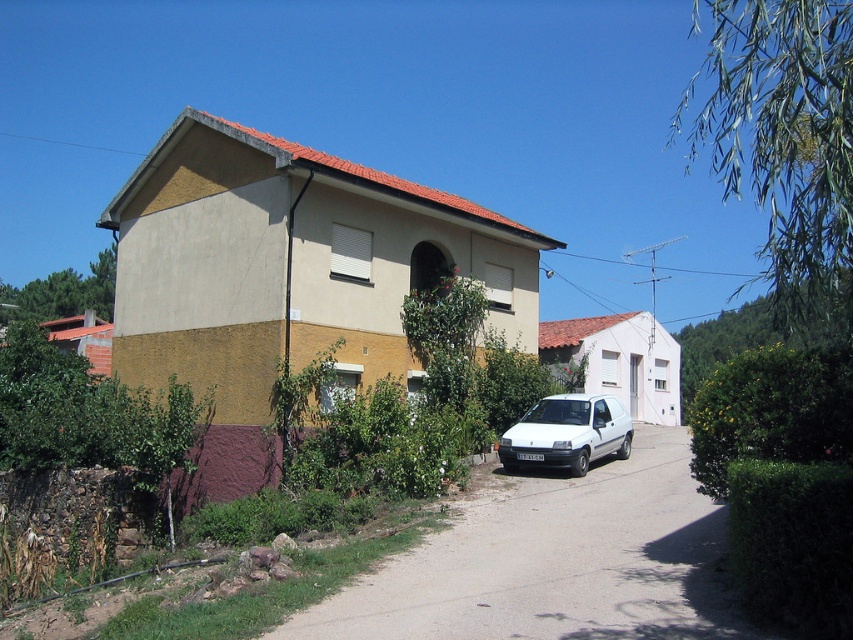
Question: Can you confirm if gray concrete driveway at center is wider than white matte van at center?

Choices:
 (A) no
 (B) yes

Answer: (B)

Question: Can you confirm if gray concrete driveway at center is smaller than white matte van at center?

Choices:
 (A) yes
 (B) no

Answer: (B)

Question: From the image, what is the correct spatial relationship of gray concrete driveway at center in relation to white matte van at center?

Choices:
 (A) right
 (B) left

Answer: (B)

Question: Which object is closer to the camera taking this photo?

Choices:
 (A) gray concrete driveway at center
 (B) white matte van at center

Answer: (A)